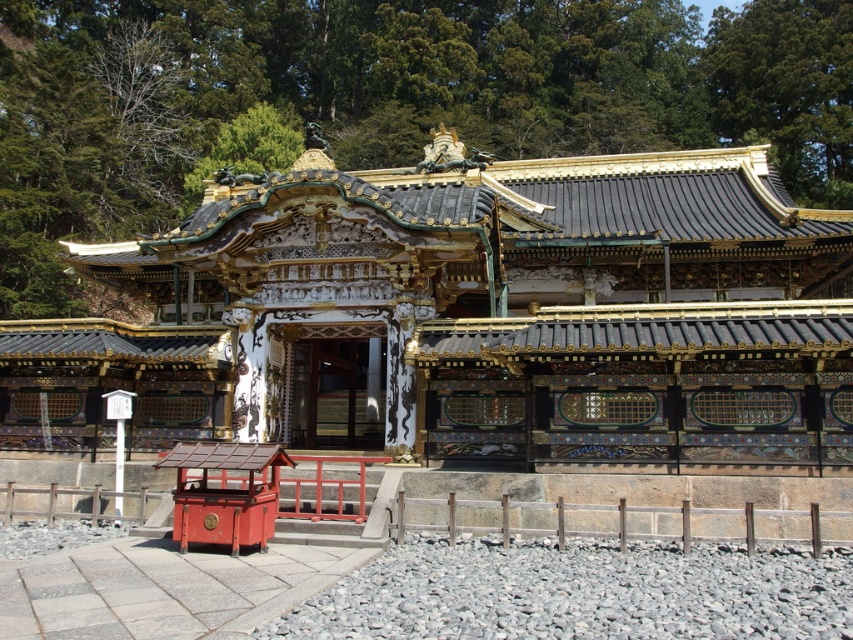
You are a visitor standing in front of the temple. You see the polished wood shrine at center and the smooth red wooden box at lower left. Which object is located to the left of the other?

The smooth red wooden box at lower left is positioned to the left of the polished wood shrine at center.

You are a visitor at the temple and want to place a small offering on the nearest object. Which object should you choose between the polished wood shrine at center and the smooth red wooden box at lower left?

The smooth red wooden box at lower left is closer to you, so you should place the offering there.

You are standing in front of a traditional Japanese shrine with a polished wood entrance. There is a point marked at coordinates (471, 317). Based on the scene description, where is this point located?

The point at (471, 317) is located on the polished wood shrine at center, as described in the scene.